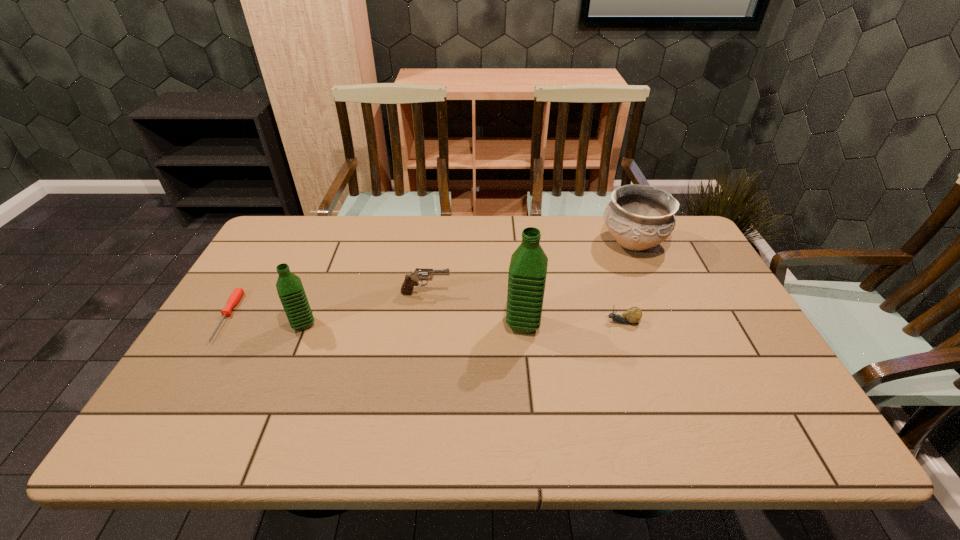
This screenshot has width=960, height=540. What are the coordinates of `free point that keeps the water bottles evenly spaced on the right` in the screenshot? It's located at (743, 324).